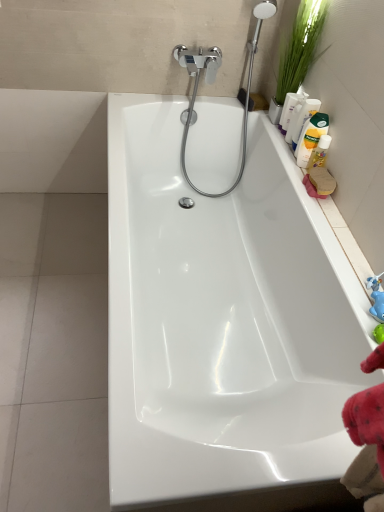
Question: From the image's perspective, is yellow matte bottle at upper right, the 4th cleaning product when ordered from bottom to top, positioned above or below green leafy plant at upper right?

Choices:
 (A) above
 (B) below

Answer: (B)

Question: Is point (306, 96) closer or farther from the camera than point (301, 18)?

Choices:
 (A) closer
 (B) farther

Answer: (B)

Question: Based on their relative distances, which object is farther from the yellow matte bottle at upper right, the first cleaning product from the top?

Choices:
 (A) translucent plastic bottle at upper right, which ranks as the 4th cleaning product in top-to-bottom order
 (B) green leafy plant at upper right
 (C) white glossy bathtub at center
 (D) matte white bottle at upper right, which is the 2th cleaning product from top to bottom
 (E) blue rubber toy at right

Answer: (E)

Question: Which object is the farthest from the translucent plastic bottle at upper right, the 1th cleaning product when ordered from bottom to top?

Choices:
 (A) white glossy bathtub at center
 (B) yellow matte bottle at upper right, the first cleaning product from the top
 (C) green leafy plant at upper right
 (D) yellow liquid bottle at upper right, which ranks as the second cleaning product in bottom-to-top order
 (E) blue rubber toy at right

Answer: (A)